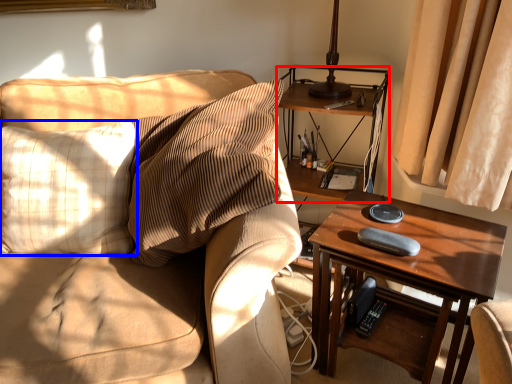
Question: Which object is further to the camera taking this photo, shelf (highlighted by a red box) or pillow (highlighted by a blue box)?

Choices:
 (A) shelf
 (B) pillow

Answer: (A)